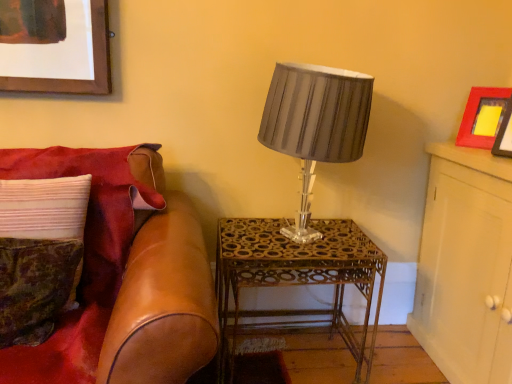
Question: From a real-world perspective, is gold metallic table at center beneath matte red picture frame at upper right?

Choices:
 (A) no
 (B) yes

Answer: (B)

Question: Would you say gold metallic table at center is outside matte red picture frame at upper right?

Choices:
 (A) no
 (B) yes

Answer: (B)

Question: Considering the relative sizes of gold metallic table at center and matte red picture frame at upper right in the image provided, is gold metallic table at center bigger than matte red picture frame at upper right?

Choices:
 (A) no
 (B) yes

Answer: (B)

Question: From the image's perspective, would you say gold metallic table at center is shown under matte red picture frame at upper right?

Choices:
 (A) no
 (B) yes

Answer: (B)

Question: Could you tell me if gold metallic table at center is facing matte red picture frame at upper right?

Choices:
 (A) yes
 (B) no

Answer: (B)

Question: Considering their positions, is leather couch at left located in front of or behind matte gray fabric lampshade at center?

Choices:
 (A) front
 (B) behind

Answer: (A)

Question: Is leather couch at left taller or shorter than matte gray fabric lampshade at center?

Choices:
 (A) short
 (B) tall

Answer: (B)

Question: Is leather couch at left to the left or to the right of matte gray fabric lampshade at center in the image?

Choices:
 (A) right
 (B) left

Answer: (B)

Question: From a real-world perspective, is leather couch at left physically located above or below matte gray fabric lampshade at center?

Choices:
 (A) below
 (B) above

Answer: (A)

Question: Is leather couch at left situated inside white wood cabinet at upper right or outside?

Choices:
 (A) outside
 (B) inside

Answer: (A)

Question: Is point (196, 299) positioned closer to the camera than point (474, 326)?

Choices:
 (A) closer
 (B) farther

Answer: (A)

Question: In the image, is leather couch at left positioned in front of or behind white wood cabinet at upper right?

Choices:
 (A) behind
 (B) front

Answer: (B)

Question: Is leather couch at left bigger or smaller than white wood cabinet at upper right?

Choices:
 (A) big
 (B) small

Answer: (A)

Question: From a real-world perspective, relative to matte gray fabric lampshade at center, is velvet green pillow at left, which ranks as the second pillow in back-to-front order, vertically above or below?

Choices:
 (A) below
 (B) above

Answer: (A)

Question: Is velvet green pillow at left, placed as the first pillow when sorted from front to back, inside or outside of matte gray fabric lampshade at center?

Choices:
 (A) inside
 (B) outside

Answer: (B)